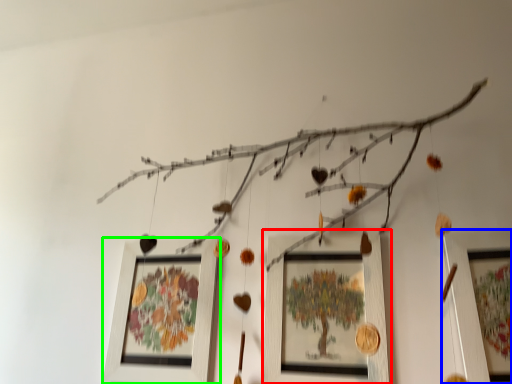
Question: Which object is positioned farthest from picture frame (highlighted by a red box)? Select from picture frame (highlighted by a blue box) and picture frame (highlighted by a green box).

Choices:
 (A) picture frame
 (B) picture frame

Answer: (B)